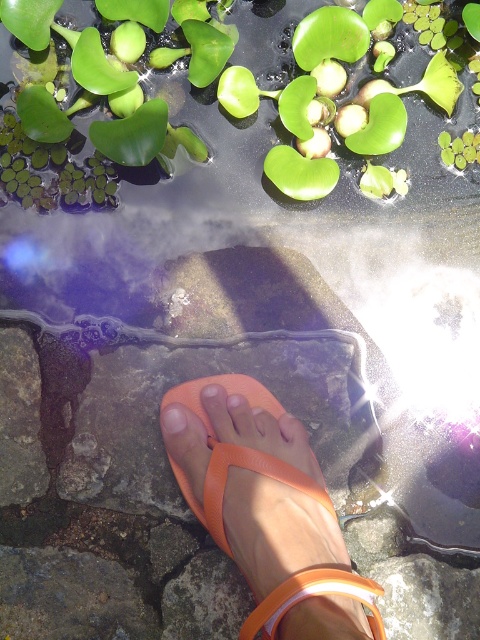
Is green leafy plant at upper center below orange rubber sandal at center?

No.

From the picture: Can you confirm if green leafy plant at upper center is taller than orange rubber sandal at center?

Incorrect, green leafy plant at upper center's height is not larger of orange rubber sandal at center's.

At what (x,y) coordinates should I click in order to perform the action: click on green leafy plant at upper center. Please return your answer as a coordinate pair (x, y). The width and height of the screenshot is (480, 640). Looking at the image, I should click on (188, 68).

Is green leafy plant at upper center above pale skin at center?

Correct, green leafy plant at upper center is located above pale skin at center.

Based on the photo, who is more forward, [433,74] or [160,412]?

Point [160,412] is more forward.

Where is `green leafy plant at upper center`? This screenshot has width=480, height=640. green leafy plant at upper center is located at coordinates (188, 68).

Is orange rubber sandal at center to the left of pale skin at center from the viewer's perspective?

In fact, orange rubber sandal at center is to the right of pale skin at center.

Can you confirm if orange rubber sandal at center is smaller than pale skin at center?

Incorrect, orange rubber sandal at center is not smaller in size than pale skin at center.

Is point (183, 388) less distant than point (178, 406)?

No, (183, 388) is behind (178, 406).

Locate an element on the screen. The height and width of the screenshot is (640, 480). orange rubber sandal at center is located at coordinates (268, 512).